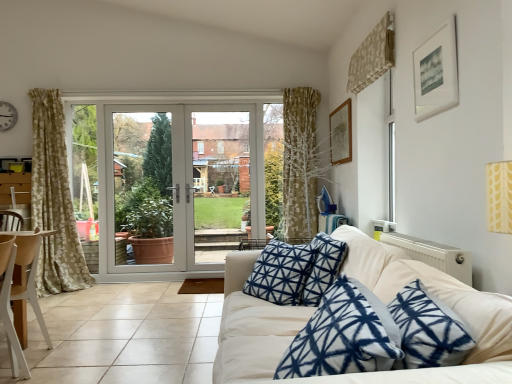
Question: Based on their sizes in the image, would you say white plastic screen door at center, the first screen door positioned from the right, is bigger or smaller than white glossy door at center, acting as the second screen door starting from the right?

Choices:
 (A) small
 (B) big

Answer: (B)

Question: Considering their positions, is white plastic screen door at center, the first screen door positioned from the right, located in front of or behind white glossy door at center, acting as the second screen door starting from the right?

Choices:
 (A) behind
 (B) front

Answer: (A)

Question: Estimate the real-world distances between objects in this image. Which object is farther from the white glossy door at center, acting as the second screen door starting from the right?

Choices:
 (A) wooden picture frame at upper right, which appears as the 2th picture frame when viewed from the right
 (B) white matte picture frame at upper right, which is counted as the first picture frame, starting from the right
 (C) white plastic screen door at center, the first screen door positioned from the right
 (D) white glossy door at center
 (E) white fabric couch at center

Answer: (B)

Question: Which is farther from the metallic wall clock at upper left?

Choices:
 (A) white plastic screen door at center, the first screen door positioned from the right
 (B) wooden chair at left
 (C) white glossy door at center, marked as the first screen door in a left-to-right arrangement
 (D) white fabric couch at center
 (E) beige tile at lower left

Answer: (D)